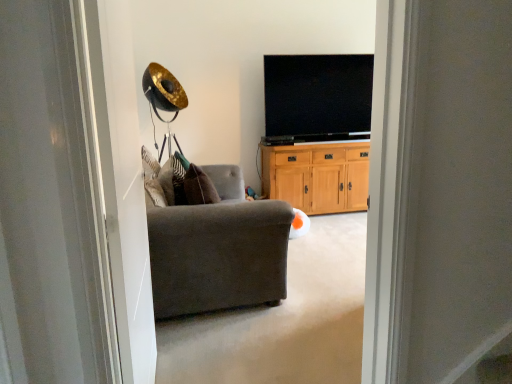
Describe the element at coordinates (118, 178) in the screenshot. I see `transparent glass screen door at left` at that location.

At what (x,y) coordinates should I click in order to perform the action: click on transparent glass screen door at left. Please return your answer as a coordinate pair (x, y). This screenshot has width=512, height=384. Looking at the image, I should click on click(x=118, y=178).

What is the approximate height of flat screen tv at upper center?

It is 35.92 inches.

The image size is (512, 384). Describe the element at coordinates (317, 98) in the screenshot. I see `flat screen tv at upper center` at that location.

Identify the location of wooden cabinet at center. pyautogui.click(x=317, y=176).

Is dark gray fabric armchair at center completely or partially outside of flat screen tv at upper center?

Indeed, dark gray fabric armchair at center is completely outside flat screen tv at upper center.

Considering the points (240, 176) and (369, 70), which point is behind, point (240, 176) or point (369, 70)?

The point (369, 70) is farther from the camera.

Between dark gray fabric armchair at center and flat screen tv at upper center, which one has smaller size?

flat screen tv at upper center is smaller.

Is dark gray fabric armchair at center bigger than transparent glass screen door at left?

Indeed, dark gray fabric armchair at center has a larger size compared to transparent glass screen door at left.

Where is `chair behind the transparent glass screen door at left`? chair behind the transparent glass screen door at left is located at coordinates point(218,250).

From a real-world perspective, is dark gray fabric armchair at center positioned under transparent glass screen door at left based on gravity?

Yes, from a real-world perspective, dark gray fabric armchair at center is beneath transparent glass screen door at left.

Is dark gray fabric armchair at center located outside transparent glass screen door at left?

dark gray fabric armchair at center lies outside transparent glass screen door at left's area.

Which object is wider, transparent glass screen door at left or flat screen tv at upper center?

flat screen tv at upper center is wider.

From the image's perspective, is transparent glass screen door at left located above or below flat screen tv at upper center?

Clearly, from the image's perspective, transparent glass screen door at left is below flat screen tv at upper center.

How far apart are transparent glass screen door at left and flat screen tv at upper center?

The distance of transparent glass screen door at left from flat screen tv at upper center is 9.69 feet.

Between point (116, 192) and point (267, 104), which one is positioned in front?

Point (116, 192)

From the image's perspective, which is below, wooden cabinet at center or transparent glass screen door at left?

From the image's view, transparent glass screen door at left is below.

Considering the sizes of wooden cabinet at center and transparent glass screen door at left in the image, is wooden cabinet at center wider or thinner than transparent glass screen door at left?

Clearly, wooden cabinet at center has more width compared to transparent glass screen door at left.

Can you confirm if wooden cabinet at center is shorter than transparent glass screen door at left?

Yes, wooden cabinet at center is shorter than transparent glass screen door at left.

Consider the image. From the image's perspective, is flat screen tv at upper center below transparent glass screen door at left?

No, from the image's perspective, flat screen tv at upper center is not below transparent glass screen door at left.

From a real-world perspective, is flat screen tv at upper center over transparent glass screen door at left?

Yes, from a real-world perspective, flat screen tv at upper center is on top of transparent glass screen door at left.

Is flat screen tv at upper center positioned with its back to transparent glass screen door at left?

No, flat screen tv at upper center is not facing away from transparent glass screen door at left.

Measure the distance between flat screen tv at upper center and transparent glass screen door at left.

A distance of 2.95 meters exists between flat screen tv at upper center and transparent glass screen door at left.

From their relative heights in the image, would you say wooden cabinet at center is taller or shorter than dark gray fabric armchair at center?

wooden cabinet at center is taller than dark gray fabric armchair at center.

Is wooden cabinet at center bigger than dark gray fabric armchair at center?

Actually, wooden cabinet at center might be smaller than dark gray fabric armchair at center.

From a real-world perspective, is wooden cabinet at center positioned over dark gray fabric armchair at center based on gravity?

Correct, in the physical world, wooden cabinet at center is higher than dark gray fabric armchair at center.

Is wooden cabinet at center not near dark gray fabric armchair at center?

Yes, wooden cabinet at center is far from dark gray fabric armchair at center.

Which of these two, transparent glass screen door at left or wooden cabinet at center, stands taller?

Standing taller between the two is transparent glass screen door at left.

Is transparent glass screen door at left outside of wooden cabinet at center?

transparent glass screen door at left is positioned outside wooden cabinet at center.

Is point (137, 321) less distant than point (338, 165)?

That is True.

Locate an element on the screen. television on the right of dark gray fabric armchair at center is located at coordinates (317, 98).

Identify the location of chair that is below the transparent glass screen door at left (from the image's perspective). This screenshot has width=512, height=384. (218, 250).

Considering their positions, is flat screen tv at upper center positioned further to transparent glass screen door at left than wooden cabinet at center?

flat screen tv at upper center lies further to transparent glass screen door at left than the other object.

Based on their spatial positions, is wooden cabinet at center or dark gray fabric armchair at center further from flat screen tv at upper center?

Among the two, dark gray fabric armchair at center is located further to flat screen tv at upper center.

Based on their spatial positions, is dark gray fabric armchair at center or flat screen tv at upper center closer to wooden cabinet at center?

flat screen tv at upper center is closer to wooden cabinet at center.

Considering their positions, is wooden cabinet at center positioned closer to dark gray fabric armchair at center than flat screen tv at upper center?

wooden cabinet at center is positioned closer to the anchor dark gray fabric armchair at center.

From the image, which object appears to be nearer to flat screen tv at upper center, wooden cabinet at center or transparent glass screen door at left?

Among the two, wooden cabinet at center is located nearer to flat screen tv at upper center.

Considering their positions, is transparent glass screen door at left positioned closer to wooden cabinet at center than dark gray fabric armchair at center?

dark gray fabric armchair at center is positioned closer to the anchor wooden cabinet at center.

Estimate the real-world distances between objects in this image. Which object is further from dark gray fabric armchair at center, transparent glass screen door at left or wooden cabinet at center?

wooden cabinet at center.

Estimate the real-world distances between objects in this image. Which object is closer to flat screen tv at upper center, transparent glass screen door at left or dark gray fabric armchair at center?

dark gray fabric armchair at center is closer to flat screen tv at upper center.

Locate an element on the screen. This screenshot has width=512, height=384. chair located between transparent glass screen door at left and wooden cabinet at center in the depth direction is located at coordinates (218, 250).

Where is `chair between transparent glass screen door at left and flat screen tv at upper center from front to back`? chair between transparent glass screen door at left and flat screen tv at upper center from front to back is located at coordinates (218, 250).

Locate an element on the screen. television between transparent glass screen door at left and wooden cabinet at center from front to back is located at coordinates (317, 98).

I want to click on television located between dark gray fabric armchair at center and wooden cabinet at center in the depth direction, so click(317, 98).